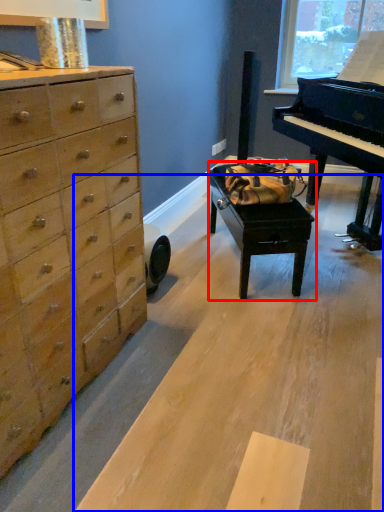
Question: Which point is closer to the camera, table (highlighted by a red box) or plywood (highlighted by a blue box)?

Choices:
 (A) table
 (B) plywood

Answer: (B)